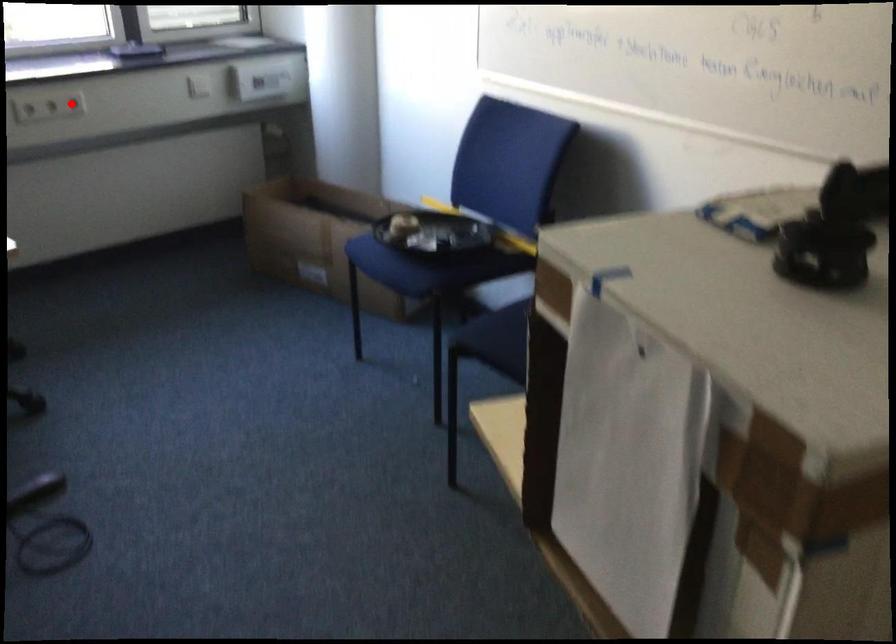
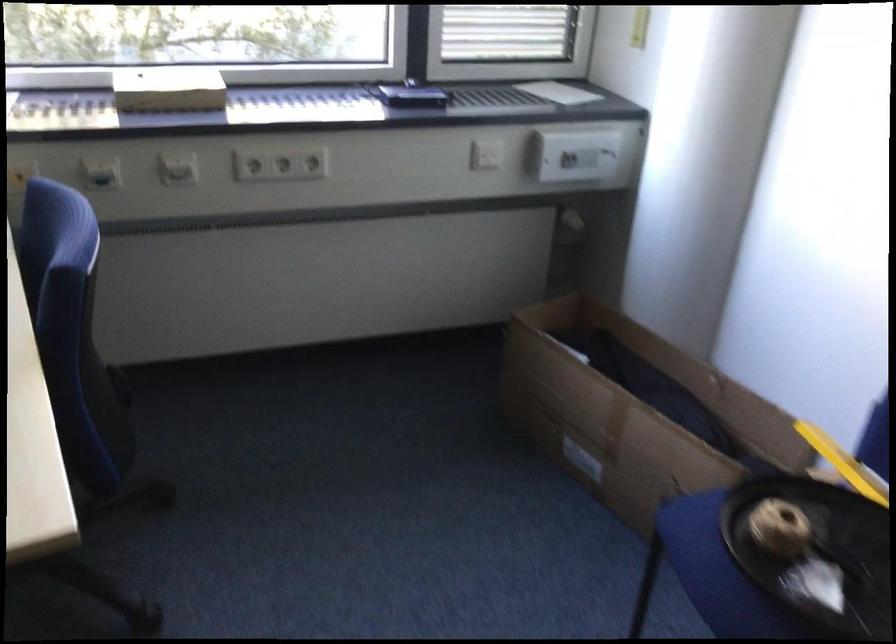
Question: I am providing you with two images of the same scene from different viewpoints. In image1, a red point is highlighted. Considering the same 3D point in image2, which of the following is correct?

Choices:
 (A) It is closer
 (B) It is farther

Answer: (A)